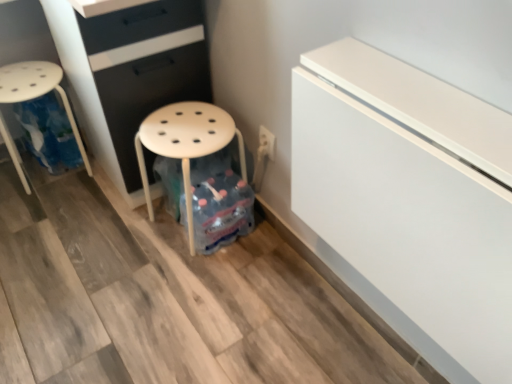
What is the approximate width of white plastic stool at left?

The width of white plastic stool at left is 12.57 inches.

In order to face white plastic stool at left, should I rotate leftwards or rightwards?

To align with it, rotate left about 26.777°.

Where is `white glossy fridge at upper right`? The image size is (512, 384). white glossy fridge at upper right is located at coordinates (411, 194).

Find the location of `white matte stool at center`. white matte stool at center is located at coordinates (186, 143).

Is matte black chest of drawers at center surrounded by white plastic stool at left?

No, matte black chest of drawers at center is located outside of white plastic stool at left.

Does white plastic stool at left have a greater width compared to matte black chest of drawers at center?

In fact, white plastic stool at left might be narrower than matte black chest of drawers at center.

From the image's perspective, which is above, white plastic stool at left or matte black chest of drawers at center?

matte black chest of drawers at center.

You are a GUI agent. You are given a task and a screenshot of the screen. Output one action in this format:
    pyautogui.click(x=<x>, y=<y>)
    Task: Click on the chest of drawers above the white plastic stool at left (from a real-world perspective)
    
    Given the screenshot: What is the action you would take?
    pyautogui.click(x=129, y=71)

From a real-world perspective, is white matte stool at center positioned above or below white glossy fridge at upper right?

In terms of real-world spatial position, white matte stool at center is below white glossy fridge at upper right.

In terms of height, does white matte stool at center look taller or shorter compared to white glossy fridge at upper right?

In the image, white matte stool at center appears to be taller than white glossy fridge at upper right.

Considering the positions of objects white matte stool at center and white glossy fridge at upper right in the image provided, who is more to the right, white matte stool at center or white glossy fridge at upper right?

From the viewer's perspective, white glossy fridge at upper right appears more on the right side.

Can you confirm if white matte stool at center is positioned to the left of white plastic stool at left?

No, white matte stool at center is not to the left of white plastic stool at left.

From a real-world perspective, who is located lower, white matte stool at center or white plastic stool at left?

white matte stool at center, from a real-world perspective.

Would you consider white matte stool at center to be distant from white plastic stool at left?

No, white matte stool at center is in close proximity to white plastic stool at left.

Is white matte stool at center positioned behind white plastic stool at left?

No, it is in front of white plastic stool at left.

Is white glossy fridge at upper right at the left side of white plastic stool at left?

Incorrect, white glossy fridge at upper right is not on the left side of white plastic stool at left.

Does white glossy fridge at upper right have a lesser width compared to white plastic stool at left?

Correct, the width of white glossy fridge at upper right is less than that of white plastic stool at left.

Can you tell me how much white glossy fridge at upper right and white plastic stool at left differ in facing direction?

white glossy fridge at upper right and white plastic stool at left are facing 86.3 degrees away from each other.

Is white glossy fridge at upper right directly adjacent to white plastic stool at left?

They are not placed beside each other.

Find the location of `fridge located in front of the white plastic stool at left`. fridge located in front of the white plastic stool at left is located at coordinates (411, 194).

How many degrees apart are the facing directions of white plastic stool at left and white glossy fridge at upper right?

86.3 degrees separate the facing orientations of white plastic stool at left and white glossy fridge at upper right.

Does white plastic stool at left lie behind white glossy fridge at upper right?

Yes, white plastic stool at left is behind white glossy fridge at upper right.

From a real-world perspective, does white plastic stool at left stand above white glossy fridge at upper right?

Incorrect, from a real-world perspective, white plastic stool at left is lower than white glossy fridge at upper right.

From a real-world perspective, between white matte stool at center and matte black chest of drawers at center, who is vertically higher?

matte black chest of drawers at center, from a real-world perspective.

Which of these two, white matte stool at center or matte black chest of drawers at center, is thinner?

With smaller width is white matte stool at center.

From the image's perspective, would you say white matte stool at center is shown under matte black chest of drawers at center?

Correct, white matte stool at center appears lower than matte black chest of drawers at center in the image.

Would you say white matte stool at center is outside matte black chest of drawers at center?

Actually, white matte stool at center is at least partially inside matte black chest of drawers at center.

How different are the orientations of matte black chest of drawers at center and white plastic stool at left in degrees?

There is a 87.2-degree angle between the facing directions of matte black chest of drawers at center and white plastic stool at left.

Considering the sizes of objects matte black chest of drawers at center and white plastic stool at left in the image provided, who is thinner, matte black chest of drawers at center or white plastic stool at left?

white plastic stool at left is thinner.

Does matte black chest of drawers at center have a greater height compared to white plastic stool at left?

Yes, matte black chest of drawers at center is taller than white plastic stool at left.

Looking at this image, which is more to the left, matte black chest of drawers at center or white plastic stool at left?

white plastic stool at left is more to the left.

You are a GUI agent. You are given a task and a screenshot of the screen. Output one action in this format:
    pyautogui.click(x=<x>, y=<y>)
    Task: Click on the chest of drawers located above the white plastic stool at left (from a real-world perspective)
    The width and height of the screenshot is (512, 384).
    Given the screenshot: What is the action you would take?
    pyautogui.click(x=129, y=71)

This screenshot has width=512, height=384. In order to click on fridge lying on the right of white matte stool at center in this screenshot , I will do `click(411, 194)`.

In the scene shown: Estimate the real-world distances between objects in this image. Which object is closer to white plastic stool at left, white matte stool at center or white glossy fridge at upper right?

Among the two, white matte stool at center is located nearer to white plastic stool at left.

Based on their spatial positions, is matte black chest of drawers at center or white matte stool at center further from white glossy fridge at upper right?

matte black chest of drawers at center.

Considering their positions, is white glossy fridge at upper right positioned further to white matte stool at center than matte black chest of drawers at center?

The object further to white matte stool at center is white glossy fridge at upper right.

In the scene shown: Based on their spatial positions, is white plastic stool at left or matte black chest of drawers at center closer to white glossy fridge at upper right?

The object closer to white glossy fridge at upper right is matte black chest of drawers at center.

Considering their positions, is matte black chest of drawers at center positioned closer to white glossy fridge at upper right than white plastic stool at left?

Based on the image, matte black chest of drawers at center appears to be nearer to white glossy fridge at upper right.

Based on their spatial positions, is matte black chest of drawers at center or white plastic stool at left closer to white matte stool at center?

matte black chest of drawers at center.

Based on their spatial positions, is white glossy fridge at upper right or white matte stool at center closer to matte black chest of drawers at center?

Among the two, white matte stool at center is located nearer to matte black chest of drawers at center.

Estimate the real-world distances between objects in this image. Which object is closer to matte black chest of drawers at center, white glossy fridge at upper right or white plastic stool at left?

white plastic stool at left lies closer to matte black chest of drawers at center than the other object.

Where is `chest of drawers between white plastic stool at left and white matte stool at center`? This screenshot has width=512, height=384. chest of drawers between white plastic stool at left and white matte stool at center is located at coordinates (129, 71).

Where is `stool situated between matte black chest of drawers at center and white glossy fridge at upper right from left to right`? The height and width of the screenshot is (384, 512). stool situated between matte black chest of drawers at center and white glossy fridge at upper right from left to right is located at coordinates (186, 143).

Identify the location of stool located between white plastic stool at left and white glossy fridge at upper right in the left-right direction. (186, 143).

Where is `chest of drawers between white plastic stool at left and white glossy fridge at upper right from left to right`? Image resolution: width=512 pixels, height=384 pixels. chest of drawers between white plastic stool at left and white glossy fridge at upper right from left to right is located at coordinates (129, 71).